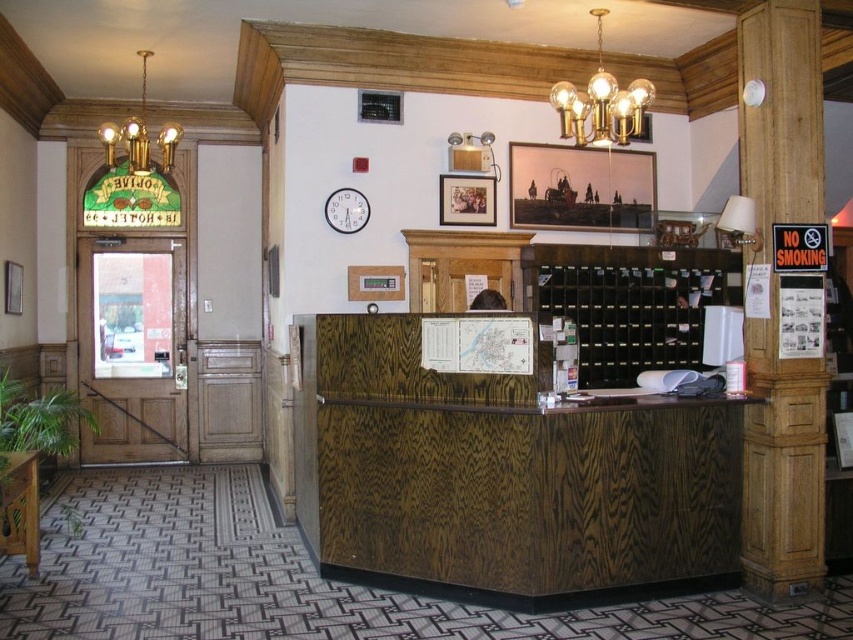
You are a guest in the hotel lobby and want to ask the receptionist for directions. You notice two items on the desk that might help you locate the information. Which item is bigger between the matte gold lampshade at upper center and the white wooden clock at upper center?

The matte gold lampshade at upper center is larger compared to the white wooden clock at upper center, so you can use the larger lampshade to help you locate the information.

In the hotel lobby, there is a gold metallic chandelier at upper center. Where exactly is it located in terms of coordinates?

The gold metallic chandelier at upper center is located at coordinates point (601, 104).

You are a guest in the hotel lobby and want to check the time using the white wooden clock at upper center. However, you notice the matte gold lampshade at upper center is blocking your view. Can you still see the time clearly?

The white wooden clock at upper center is behind the matte gold lampshade at upper center, so it is blocked and you cannot see the time clearly.